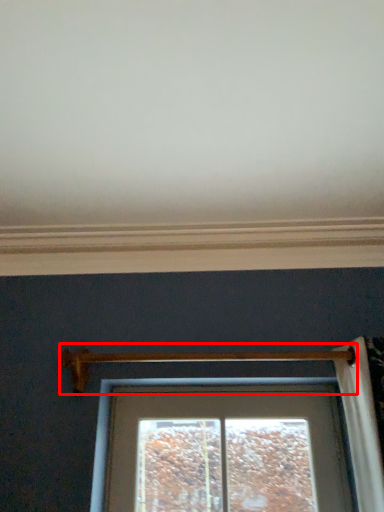
Question: In this image, where is door handle (annotated by the red box) located relative to window sill?

Choices:
 (A) left
 (B) right

Answer: (B)